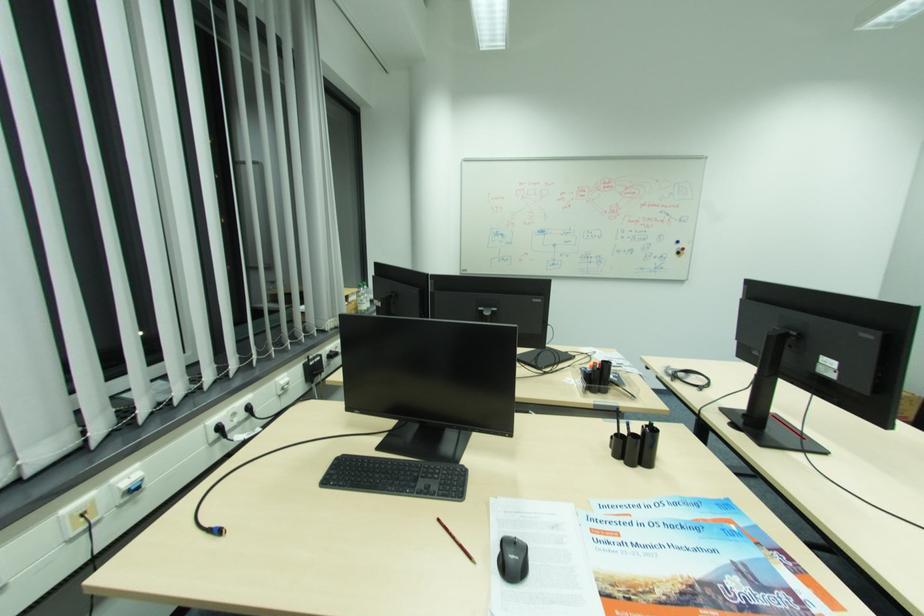
Where would you pull the blind control chain? Please return your answer as a coordinate pair (x, y).

(212, 507)